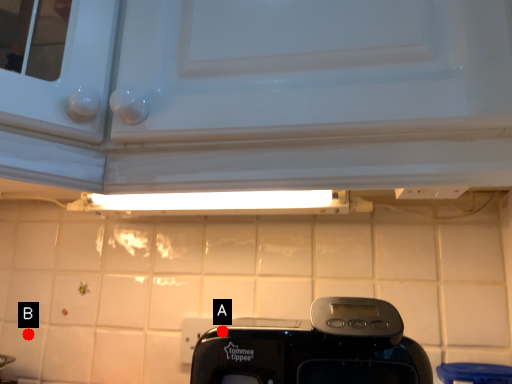
Question: Two points are circled on the image, labeled by A and B beside each circle. Which of the following is the closest to the observer?

Choices:
 (A) A is closer
 (B) B is closer

Answer: (A)